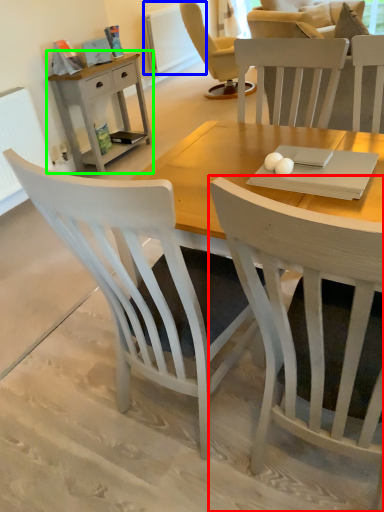
Question: Based on their relative distances, which object is nearer to chair (highlighted by a red box)? Choose from radiator (highlighted by a blue box) and nightstand (highlighted by a green box).

Choices:
 (A) radiator
 (B) nightstand

Answer: (B)